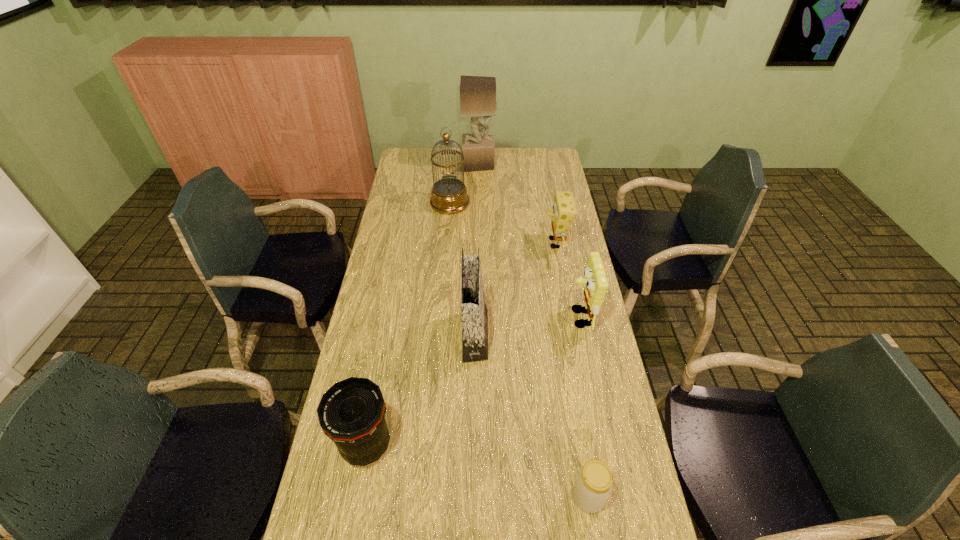
At what (x,y) coordinates should I click in order to perform the action: click on object at the far edge. Please return your answer as a coordinate pair (x, y). Looking at the image, I should click on (477, 93).

Identify the location of object located in the left edge section of the desktop. (351, 413).

Where is `jar that is at the right edge`? The image size is (960, 540). jar that is at the right edge is located at coordinates (593, 485).

This screenshot has width=960, height=540. In the image, there is a desktop. Identify the location of free region at the left edge. (387, 224).

In the image, there is a desktop. Identify the location of vacant space at the right edge. The width and height of the screenshot is (960, 540). (545, 217).

In order to click on free spot between the fifth nearest object and the shopping bag in this screenshot , I will do `click(516, 289)`.

You are a GUI agent. You are given a task and a screenshot of the screen. Output one action in this format:
    pyautogui.click(x=<x>, y=<y>)
    Task: Click on the free space between the sixth nearest object and the farther sponge
    This screenshot has width=960, height=540.
    Given the screenshot: What is the action you would take?
    pyautogui.click(x=503, y=223)

You are a GUI agent. You are given a task and a screenshot of the screen. Output one action in this format:
    pyautogui.click(x=<x>, y=<y>)
    Task: Click on the blank region between the shortest object and the leftmost object
    
    Given the screenshot: What is the action you would take?
    pyautogui.click(x=477, y=471)

The image size is (960, 540). What are the coordinates of `free space between the fifth nearest object and the sculpture` in the screenshot? It's located at (517, 204).

Where is `free space between the nearest object and the leftmost object`? Image resolution: width=960 pixels, height=540 pixels. free space between the nearest object and the leftmost object is located at coordinates (477, 471).